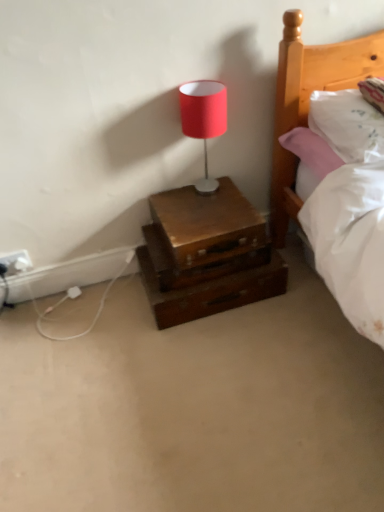
Question: Is wooden chest at lower center bigger or smaller than white soft mattress at lower right?

Choices:
 (A) small
 (B) big

Answer: (A)

Question: Considering the positions of wooden chest at lower center and white soft mattress at lower right in the image, is wooden chest at lower center wider or thinner than white soft mattress at lower right?

Choices:
 (A) wide
 (B) thin

Answer: (A)

Question: Estimate the real-world distances between objects in this image. Which object is closer to the white soft mattress at lower right?

Choices:
 (A) wooden nightstand at center
 (B) matte red lampshade at upper center
 (C) white plastic electric outlet at lower left
 (D) wooden chest at lower center
 (E) white soft pillow at upper right

Answer: (E)

Question: Which is nearer to the wooden nightstand at center?

Choices:
 (A) matte red lampshade at upper center
 (B) white soft mattress at lower right
 (C) wooden chest at lower center
 (D) white soft pillow at upper right
 (E) white plastic electric outlet at lower left

Answer: (C)